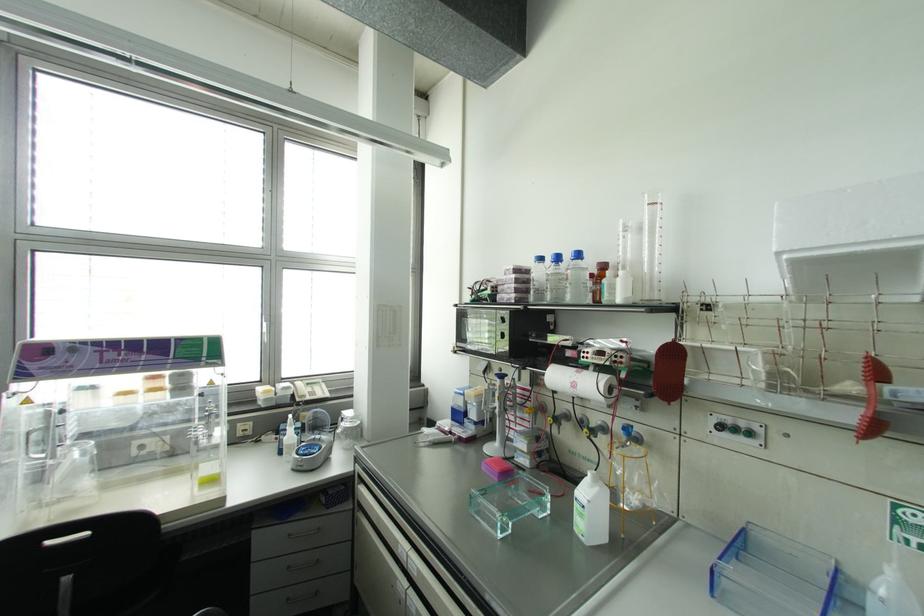
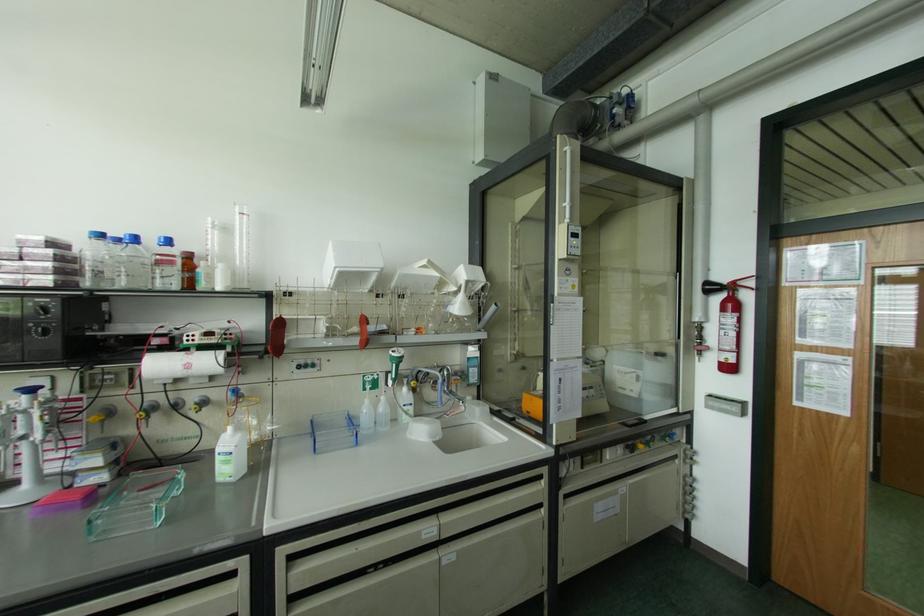
Locate, in the second image, the point that corresponds to [540,257] in the first image.

(101, 236)